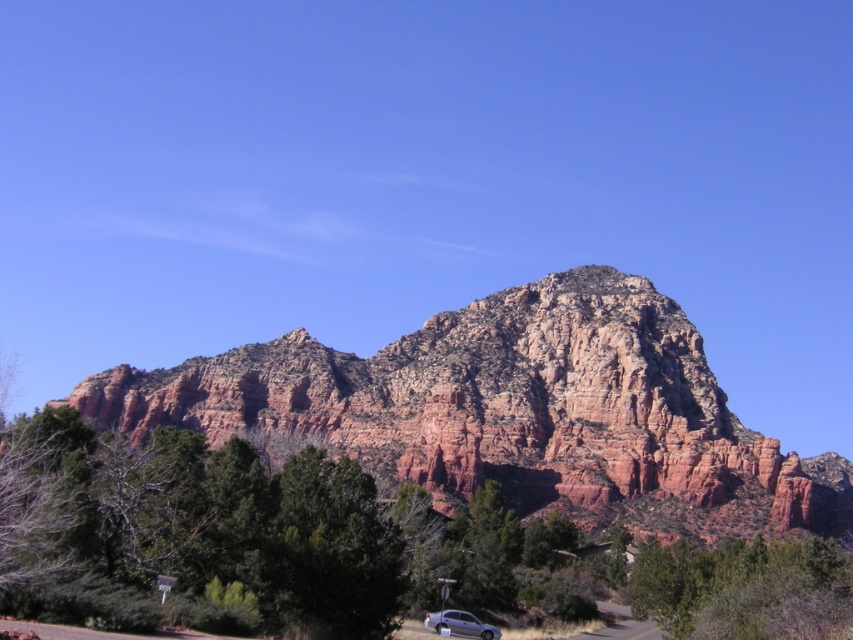
You are standing at the base of the mountain and want to reach the point marked at coordinates (x=650, y=476). Given that the path is steep and rocky, can you estimate how far you need to walk to reach that point?

The point marked at coordinates (x=650, y=476) is 118.33 meters away from the viewer, so you would need to walk approximately 118.33 meters to reach it.

You are planning to set up a small campsite in this area. Considering the rustic rock formation at center and the green leafy tree at lower right, which one would provide more shade coverage for your tent?

The rustic rock formation at center is larger in size than the green leafy tree at lower right, so it would provide more shade coverage for your tent.